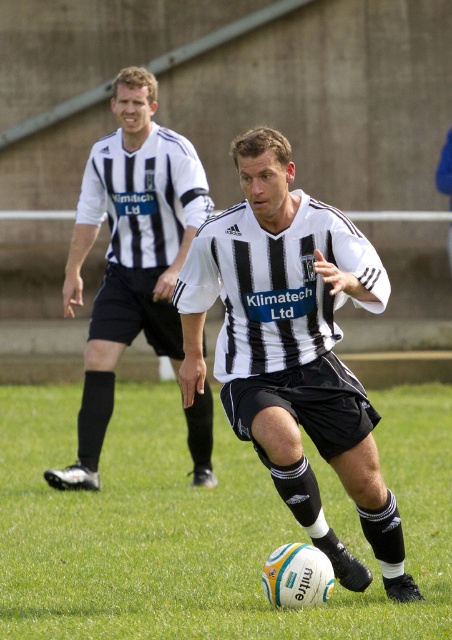
You are a soccer coach analyzing the match. The field has a goal post located at coordinates point 0.8, 0.4. Where is the white textured football at center relative to the goal post?

The white textured football at center is positioned at point (202,525), which is slightly to the right and above the goal post located at (180,512).

Based on the scene description, can you determine if the white textured football at center is taller or shorter than the black and white striped shirt at left?

The white textured football at center is not as tall as black and white striped shirt at left, so it is shorter.